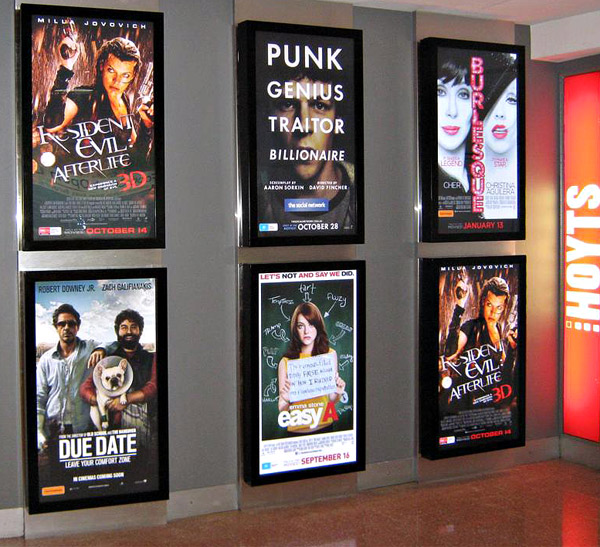
Locate an element on the screen. board is located at coordinates (330, 300).